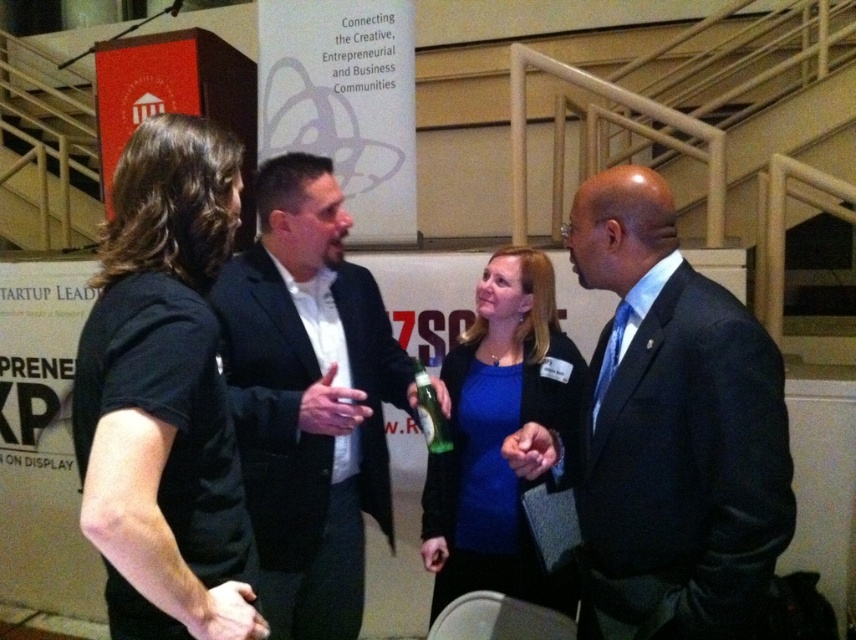
Is point (138, 400) closer to viewer compared to point (480, 572)?

Yes.

Between matte black shirt at center and blue matte shirt at center, which one has more height?

Standing taller between the two is blue matte shirt at center.

Image resolution: width=856 pixels, height=640 pixels. Describe the element at coordinates (164, 394) in the screenshot. I see `matte black shirt at center` at that location.

What are the coordinates of `matte black shirt at center` in the screenshot? It's located at (164, 394).

In the scene shown: Who is higher up, matte black shirt at center or green glass bottle at center?

matte black shirt at center

Does matte black shirt at center come behind green glass bottle at center?

No, it is in front of green glass bottle at center.

Does point (214, 454) lie behind point (417, 388)?

No, (214, 454) is in front of (417, 388).

The width and height of the screenshot is (856, 640). What are the coordinates of `matte black shirt at center` in the screenshot? It's located at (x=164, y=394).

Is blue matte shirt at center thinner than green glass bottle at center?

In fact, blue matte shirt at center might be wider than green glass bottle at center.

Is blue matte shirt at center closer to camera compared to green glass bottle at center?

Yes, blue matte shirt at center is closer to the viewer.

Identify the location of blue matte shirt at center. (498, 436).